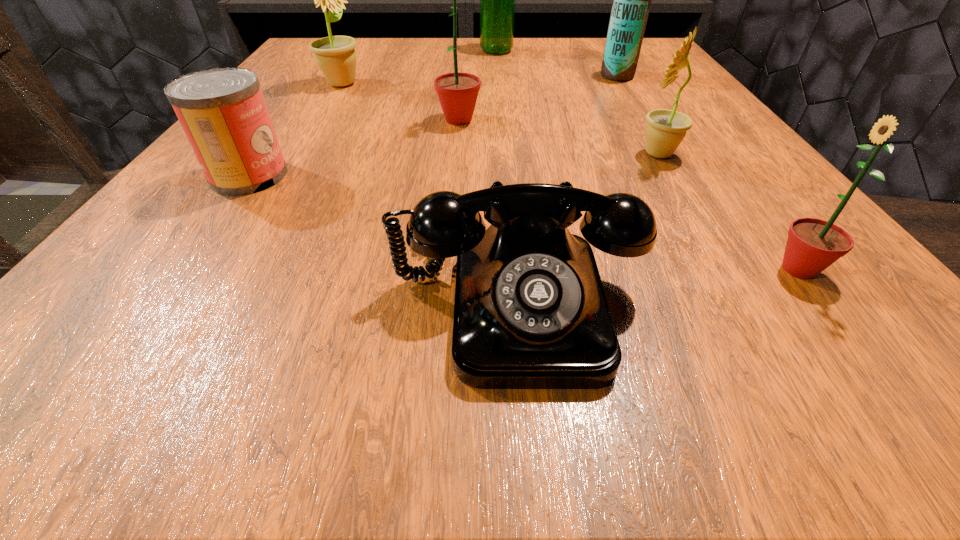
Find the location of a particular element. Image resolution: width=960 pixels, height=540 pixels. free spot between the right yellow sunflower and the farthest sunflower is located at coordinates (500, 119).

Locate an element on the screen. The width and height of the screenshot is (960, 540). empty location between the can and the third sunflower from left to right is located at coordinates (453, 165).

I want to click on free space between the can and the right beer bottle, so click(433, 126).

The image size is (960, 540). Find the location of `vacant region between the rightmost object and the green beer bottle`. vacant region between the rightmost object and the green beer bottle is located at coordinates (647, 160).

Where is `empty space that is in between the nearer beer bottle and the left beer bottle`? empty space that is in between the nearer beer bottle and the left beer bottle is located at coordinates (557, 63).

Where is `free space between the nearer green sunflower and the nearer yellow sunflower`? Image resolution: width=960 pixels, height=540 pixels. free space between the nearer green sunflower and the nearer yellow sunflower is located at coordinates (729, 212).

Identify the location of vacant region between the nearer green sunflower and the telephone. tap(659, 285).

Find the location of a particular element. The image size is (960, 540). vacant space that's between the nearer beer bottle and the right yellow sunflower is located at coordinates (637, 115).

This screenshot has width=960, height=540. I want to click on the fifth closest object to the right beer bottle, so 530,312.

Identify the location of object that ranks as the second closest to the can. click(457, 92).